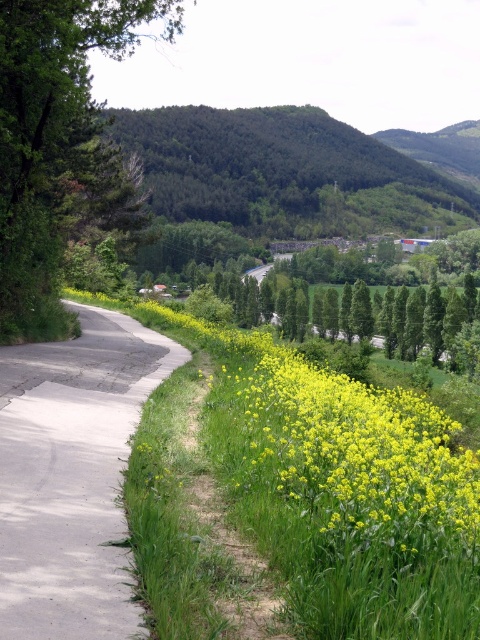
You are a hiker standing at the edge of the green leafy tree at left and want to cross the gray concrete road at center to reach the other side. Which direction should you walk to cross the road safely?

The gray concrete road at center is to the right of the green leafy tree at left, so to cross the road safely, you should walk towards the right direction from the green leafy tree at left to reach the opposite side of the gray concrete road at center.